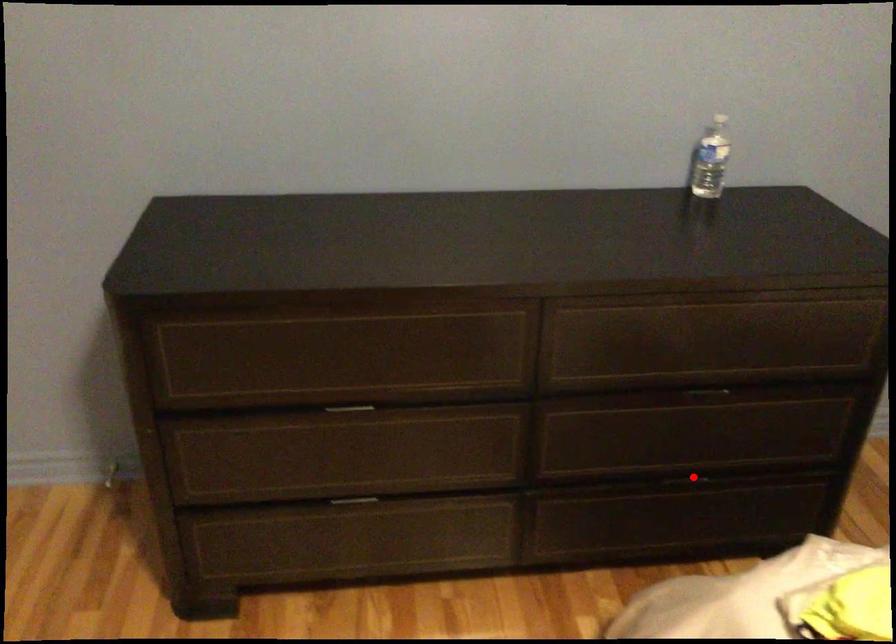
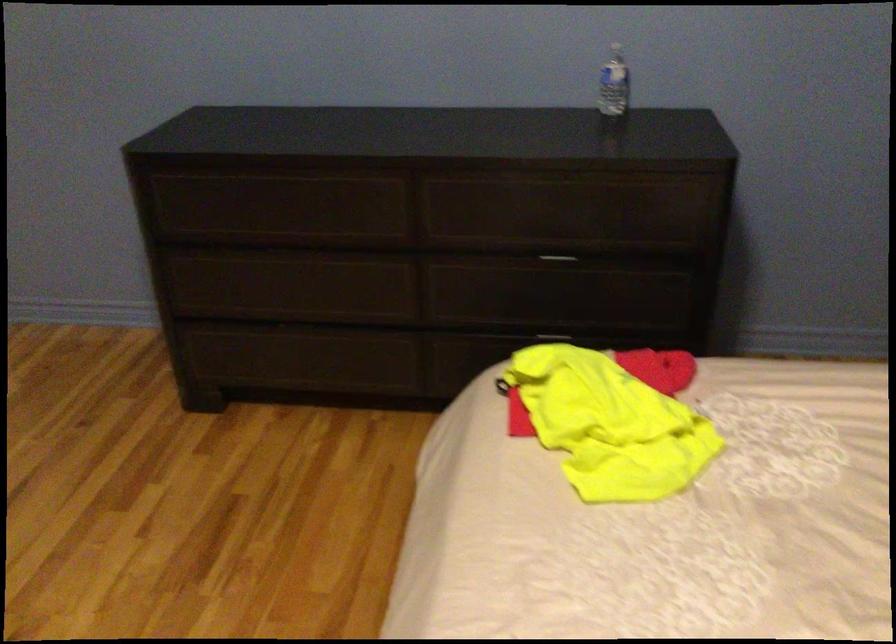
In the second image, find the point that corresponds to the highlighted location in the first image.

(553, 333)